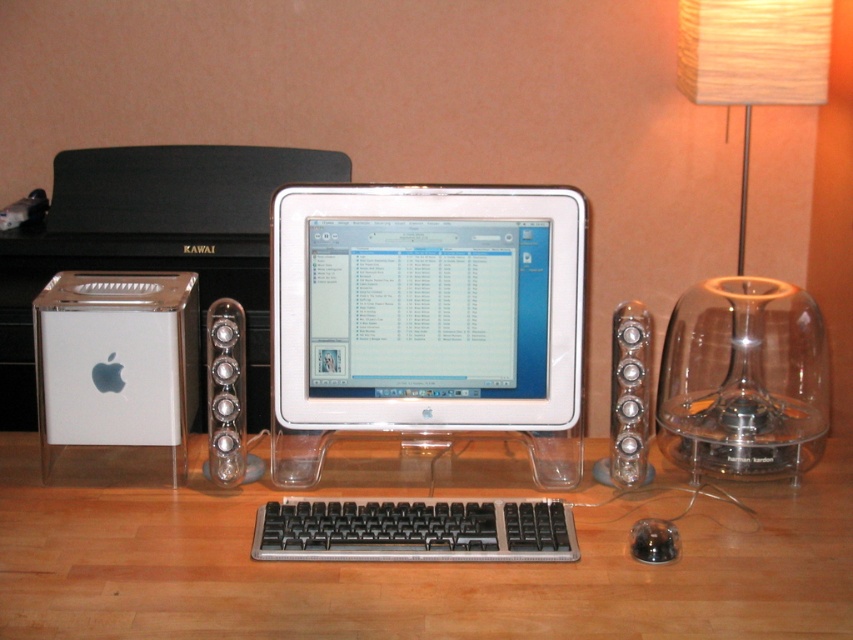
Question: Is white glossy monitor at center smaller than black plastic keyboard at center?

Choices:
 (A) no
 (B) yes

Answer: (A)

Question: Which of these objects is positioned farthest from the black plastic keyboard at center?

Choices:
 (A) silver metallic speaker at right
 (B) white plastic ipod at left
 (C) clear plastic keyboard at center

Answer: (B)

Question: Observing the image, what is the correct spatial positioning of white plastic ipod at left in reference to satin silver speaker at center?

Choices:
 (A) above
 (B) below

Answer: (A)

Question: Which point is closer to the camera taking this photo?

Choices:
 (A) (747, 150)
 (B) (231, 412)
 (C) (141, 634)

Answer: (C)

Question: Which object appears farthest from the camera in this image?

Choices:
 (A) white glossy monitor at center
 (B) silver metallic speaker at right
 (C) satin silver speaker at center

Answer: (B)

Question: Is the position of white glossy monitor at center less distant than that of translucent glass dome at right?

Choices:
 (A) yes
 (B) no

Answer: (A)